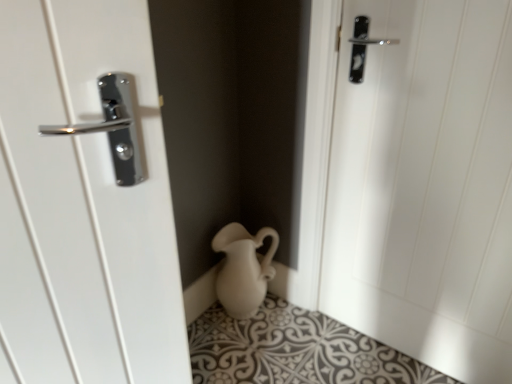
Question: Is white matte jug at center spatially inside white glossy door handle at upper center, or outside of it?

Choices:
 (A) inside
 (B) outside

Answer: (B)

Question: From the image's perspective, is white matte jug at center positioned above or below white glossy door handle at upper center?

Choices:
 (A) above
 (B) below

Answer: (B)

Question: Is white matte jug at center in front of or behind white glossy door handle at upper center in the image?

Choices:
 (A) behind
 (B) front

Answer: (A)

Question: Which is correct: white glossy door handle at upper center is inside white matte jug at center, or outside of it?

Choices:
 (A) inside
 (B) outside

Answer: (B)

Question: Visually, is white glossy door handle at upper center positioned to the left or to the right of white matte jug at center?

Choices:
 (A) left
 (B) right

Answer: (B)

Question: Is white glossy door handle at upper center taller or shorter than white matte jug at center?

Choices:
 (A) tall
 (B) short

Answer: (A)

Question: From a real-world perspective, is white glossy door handle at upper center positioned above or below white matte jug at center?

Choices:
 (A) below
 (B) above

Answer: (B)